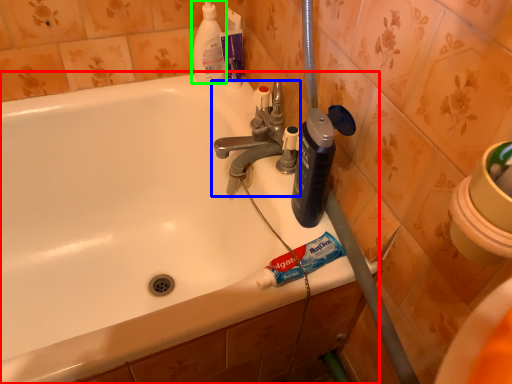
Question: Considering the real-world distances, which object is closest to bathtub (highlighted by a red box)? tap (highlighted by a blue box) or cleaning product (highlighted by a green box).

Choices:
 (A) tap
 (B) cleaning product

Answer: (A)